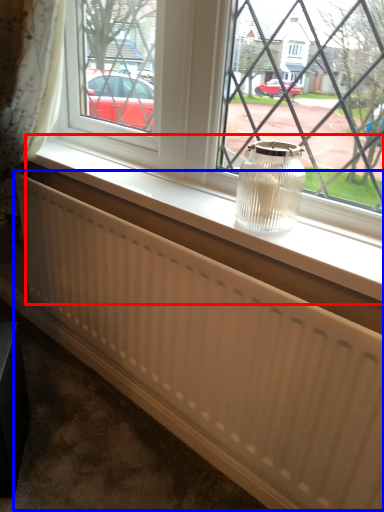
Question: Which point is closer to the camera, window sill (highlighted by a red box) or radiator (highlighted by a blue box)?

Choices:
 (A) window sill
 (B) radiator

Answer: (B)